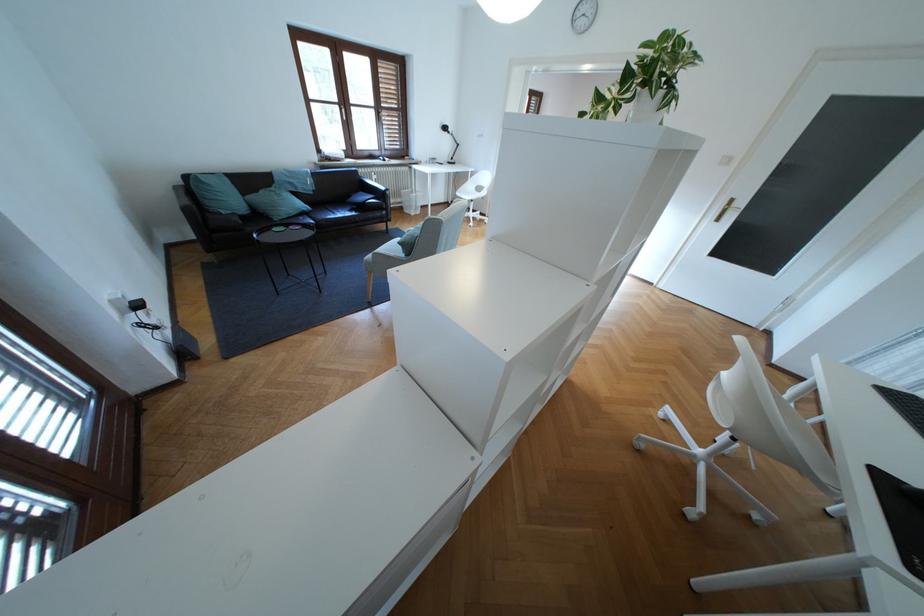
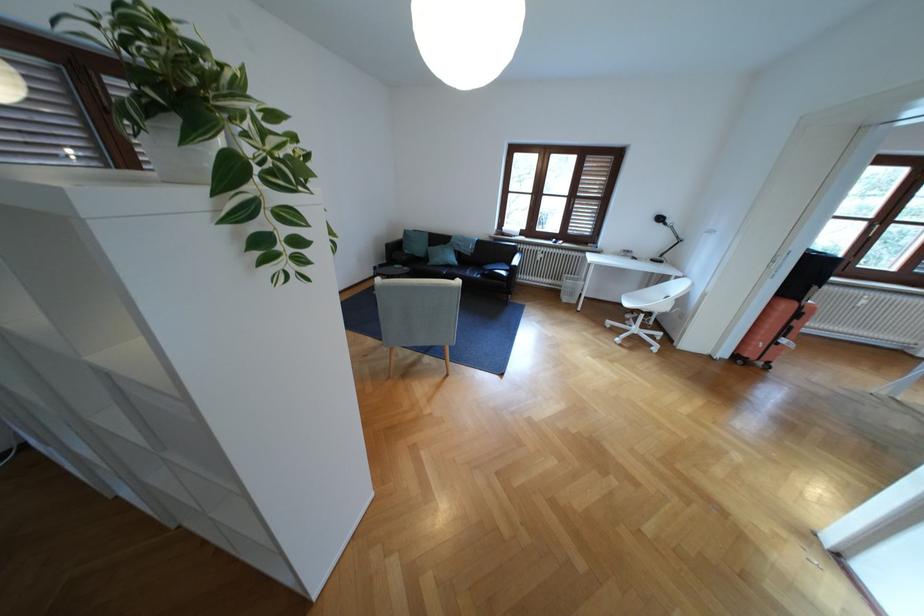
Where in the second image is the point corresponding to the point at 253,193 from the first image?

(440, 246)